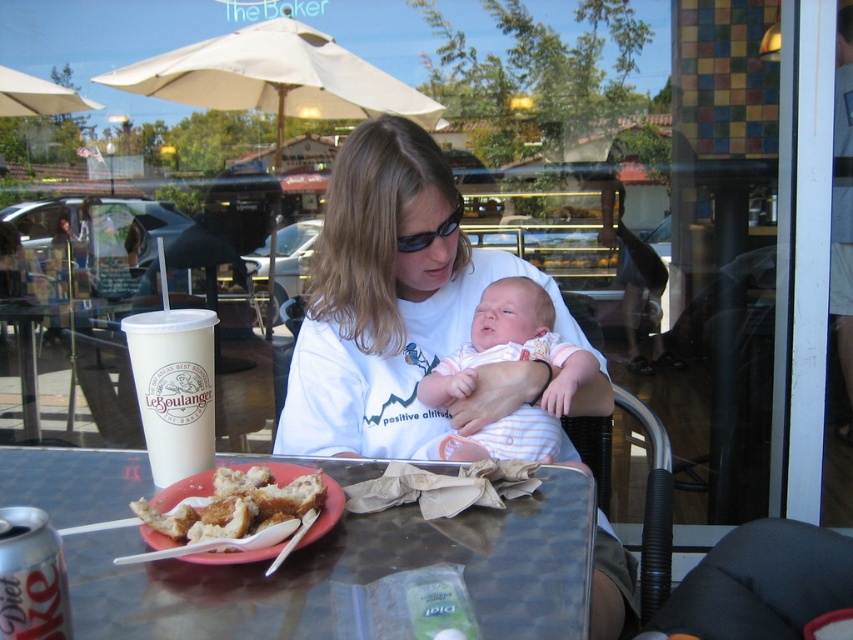
Question: Which of the following is the closest to the observer?

Choices:
 (A) (53, 502)
 (B) (186, 365)
 (C) (416, 134)
 (D) (531, 333)

Answer: (B)

Question: Which point is farther from the camera taking this photo?

Choices:
 (A) (140, 365)
 (B) (428, 259)

Answer: (B)

Question: Can you confirm if striped cotton onesie at center is positioned to the right of white paper cup at table center?

Choices:
 (A) yes
 (B) no

Answer: (A)

Question: Is striped cotton onesie at center bigger than golden fried pastry at center?

Choices:
 (A) no
 (B) yes

Answer: (B)

Question: Based on their relative distances, which object is nearer to the white cotton shirt at center?

Choices:
 (A) metallic reflective table at center
 (B) golden fried pastry at center
 (C) striped cotton onesie at center
 (D) white paper cup at table center

Answer: (C)

Question: Does white cotton shirt at center have a larger size compared to golden fried pastry at center?

Choices:
 (A) no
 (B) yes

Answer: (B)